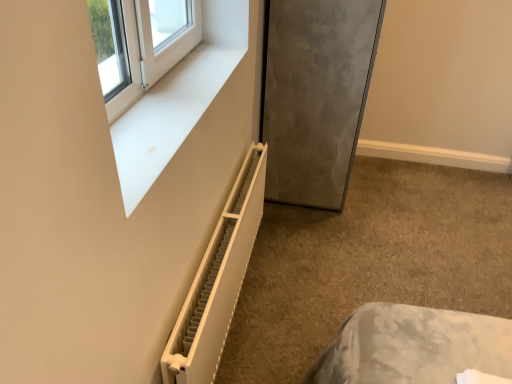
Identify the location of white plastic window frame at upper left. point(178,100).

What do you see at coordinates (369, 262) in the screenshot?
I see `white matte radiator at lower left` at bounding box center [369, 262].

Identify the location of white plastic window frame at upper left. (178, 100).

From a real-world perspective, is white plastic window frame at upper left above or below white matte radiator at lower left?

From a real-world perspective, white plastic window frame at upper left is physically above white matte radiator at lower left.

Is white plastic window frame at upper left further to the viewer compared to white matte radiator at lower left?

No, the depth of white plastic window frame at upper left is less than that of white matte radiator at lower left.

Which is closer, (129, 203) or (358, 160)?

Point (129, 203) is positioned closer to the camera compared to point (358, 160).

Is white plastic window frame at upper left outside of white matte radiator at lower left?

Yes, white plastic window frame at upper left is not within white matte radiator at lower left.

Does point (325, 274) appear closer or farther from the camera than point (202, 360)?

Point (325, 274) appears to be farther away from the viewer than point (202, 360).

Can you confirm if white matte radiator at lower left is shorter than white plastic radiator at lower left?

Yes.

Between white matte radiator at lower left and white plastic radiator at lower left, which one appears on the right side from the viewer's perspective?

From the viewer's perspective, white matte radiator at lower left appears more on the right side.

Between satin gray refrigerator at lower right and white plastic radiator at lower left, which one has less height?

Standing shorter between the two is white plastic radiator at lower left.

Are satin gray refrigerator at lower right and white plastic radiator at lower left making contact?

They are not placed beside each other.

This screenshot has height=384, width=512. Find the location of `radiator in front of the satin gray refrigerator at lower right`. radiator in front of the satin gray refrigerator at lower right is located at coordinates click(x=218, y=280).

Is satin gray refrigerator at lower right further to the viewer compared to white plastic radiator at lower left?

That is True.

Between white plastic radiator at lower left and white matte radiator at lower left, which one appears on the left side from the viewer's perspective?

Positioned to the left is white plastic radiator at lower left.

Is white plastic radiator at lower left oriented away from white matte radiator at lower left?

No, white plastic radiator at lower left is not facing away from white matte radiator at lower left.

Between white plastic radiator at lower left and white matte radiator at lower left, which one has larger width?

With larger width is white matte radiator at lower left.

Which is in front, point (225, 270) or point (106, 109)?

The point (106, 109) is closer to the camera.

From the image's perspective, between white plastic radiator at lower left and white plastic window frame at upper left, which one is located above?

white plastic window frame at upper left.

Is white plastic radiator at lower left oriented away from white plastic window frame at upper left?

No, white plastic radiator at lower left is not facing the opposite direction of white plastic window frame at upper left.

From the picture: From a real-world perspective, between white plastic radiator at lower left and white plastic window frame at upper left, who is vertically lower?

white plastic radiator at lower left, from a real-world perspective.

Are satin gray refrigerator at lower right and white matte radiator at lower left making contact?

No, satin gray refrigerator at lower right is not with white matte radiator at lower left.

How many degrees apart are the facing directions of satin gray refrigerator at lower right and white matte radiator at lower left?

There is a 89.8-degree angle between the facing directions of satin gray refrigerator at lower right and white matte radiator at lower left.

From a real-world perspective, is satin gray refrigerator at lower right physically located above or below white matte radiator at lower left?

In terms of real-world spatial position, satin gray refrigerator at lower right is above white matte radiator at lower left.

Which is nearer, (357, 79) or (305, 311)?

The point (305, 311) is closer.

From the image's perspective, does white plastic window frame at upper left appear higher than white plastic radiator at lower left?

Yes, from the image's perspective, white plastic window frame at upper left is on top of white plastic radiator at lower left.

Could you tell me if white plastic window frame at upper left is turned towards white plastic radiator at lower left?

No, white plastic window frame at upper left is not turned towards white plastic radiator at lower left.

Locate an element on the screen. This screenshot has height=384, width=512. radiator lying below the white plastic window frame at upper left (from the image's perspective) is located at coordinates (218, 280).

Where is `concrete beneath the white plastic window frame at upper left (from a real-world perspective)`? concrete beneath the white plastic window frame at upper left (from a real-world perspective) is located at coordinates (369, 262).

This screenshot has width=512, height=384. I want to click on concrete located above the white plastic radiator at lower left (from the image's perspective), so click(369, 262).

Which object lies further to the anchor point white matte radiator at lower left, white plastic radiator at lower left or satin gray refrigerator at lower right?

white plastic radiator at lower left is positioned further to the anchor white matte radiator at lower left.

Estimate the real-world distances between objects in this image. Which object is closer to white plastic window frame at upper left, white plastic radiator at lower left or satin gray refrigerator at lower right?

white plastic radiator at lower left is positioned closer to the anchor white plastic window frame at upper left.

Based on their spatial positions, is white matte radiator at lower left or white plastic window frame at upper left further from white plastic radiator at lower left?

Among the two, white matte radiator at lower left is located further to white plastic radiator at lower left.

Based on their spatial positions, is satin gray refrigerator at lower right or white plastic window frame at upper left further from white plastic radiator at lower left?

satin gray refrigerator at lower right lies further to white plastic radiator at lower left than the other object.

From the image, which object appears to be nearer to white plastic radiator at lower left, white plastic window frame at upper left or white matte radiator at lower left?

white plastic window frame at upper left lies closer to white plastic radiator at lower left than the other object.

When comparing their distances from white matte radiator at lower left, does satin gray refrigerator at lower right or white plastic window frame at upper left seem further?

white plastic window frame at upper left lies further to white matte radiator at lower left than the other object.

When comparing their distances from white plastic radiator at lower left, does white matte radiator at lower left or satin gray refrigerator at lower right seem closer?

white matte radiator at lower left is closer to white plastic radiator at lower left.

Considering their positions, is white matte radiator at lower left positioned closer to satin gray refrigerator at lower right than white plastic window frame at upper left?

white matte radiator at lower left lies closer to satin gray refrigerator at lower right than the other object.

Image resolution: width=512 pixels, height=384 pixels. I want to click on concrete between satin gray refrigerator at lower right and white plastic radiator at lower left in the up-down direction, so click(369, 262).

Locate an element on the screen. The width and height of the screenshot is (512, 384). fridge situated between white plastic window frame at upper left and white matte radiator at lower left from left to right is located at coordinates (315, 95).

At what (x,y) coordinates should I click in order to perform the action: click on radiator between white plastic window frame at upper left and white matte radiator at lower left in the horizontal direction. Please return your answer as a coordinate pair (x, y). Looking at the image, I should click on (218, 280).

Where is `radiator located between white plastic window frame at upper left and satin gray refrigerator at lower right in the depth direction`? This screenshot has height=384, width=512. radiator located between white plastic window frame at upper left and satin gray refrigerator at lower right in the depth direction is located at coordinates (218, 280).